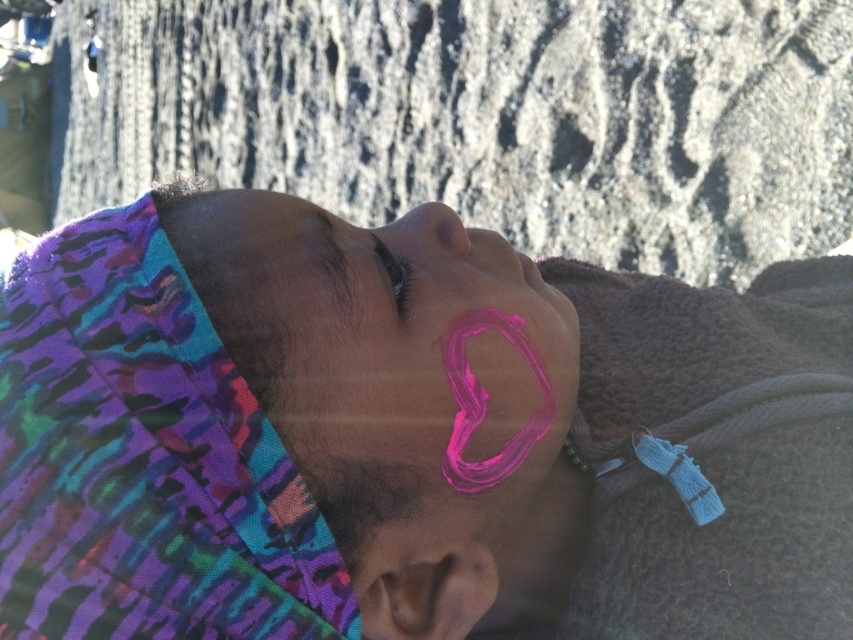
Is purple fabric headscarf at left above black matte eye at upper center?

Actually, purple fabric headscarf at left is below black matte eye at upper center.

Measure the distance between purple fabric headscarf at left and black matte eye at upper center.

A distance of 8.58 inches exists between purple fabric headscarf at left and black matte eye at upper center.

Who is more distant from viewer, (112, 212) or (405, 292)?

Point (405, 292)

Where is `purple fabric headscarf at left`? purple fabric headscarf at left is located at coordinates (143, 460).

Does purple fabric headscarf at left appear on the right side of pink matte heart at center?

No, purple fabric headscarf at left is not to the right of pink matte heart at center.

Can you confirm if purple fabric headscarf at left is wider than pink matte heart at center?

Yes, purple fabric headscarf at left is wider than pink matte heart at center.

Is point (51, 339) closer to camera compared to point (450, 228)?

Yes, point (51, 339) is in front of point (450, 228).

Identify the location of purple fabric headscarf at left. (143, 460).

Who is positioned more to the right, purple fabric headscarf at left or pink matte face paint at center?

pink matte face paint at center is more to the right.

Which is behind, point (83, 381) or point (509, 340)?

Positioned behind is point (509, 340).

The height and width of the screenshot is (640, 853). What are the coordinates of `purple fabric headscarf at left` in the screenshot? It's located at (143, 460).